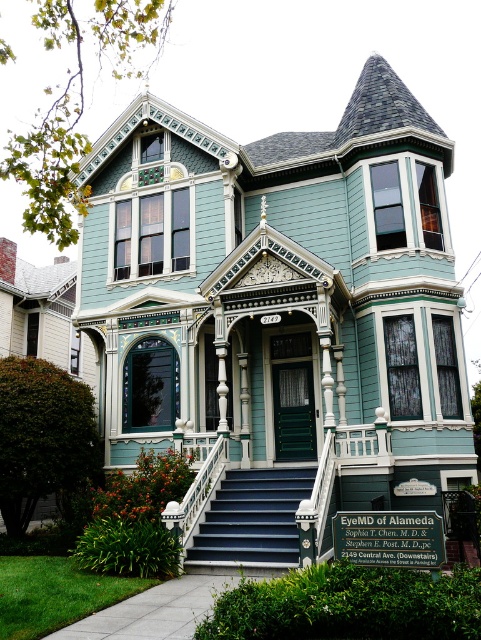
You are a delivery person carrying a large package that is 2 meters wide. You arrive at the house and need to go up the blue painted wood stairs at center. Can you safely carry the package up the stairs while avoiding the white glossy balustrade at center?

The blue painted wood stairs at center is wider than the white glossy balustrade at center. Since the stairs are wider, there should be enough space to carry the 2m wide package up the stairs while avoiding the narrower balustrade.

Looking at this image, you are a delivery person approaching the house and need to reach the dark green door. You see the blue painted wood stairs at center and the white glossy balustrade at center. Which object should you step onto first to reach the door?

You should step onto the blue painted wood stairs at center first because it is closer to the viewer than the white glossy balustrade at center.